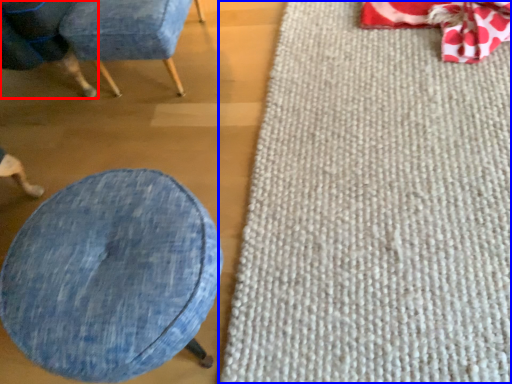
Question: Which of the following is the farthest to the observer, chair (highlighted by a red box) or mat (highlighted by a blue box)?

Choices:
 (A) chair
 (B) mat

Answer: (A)